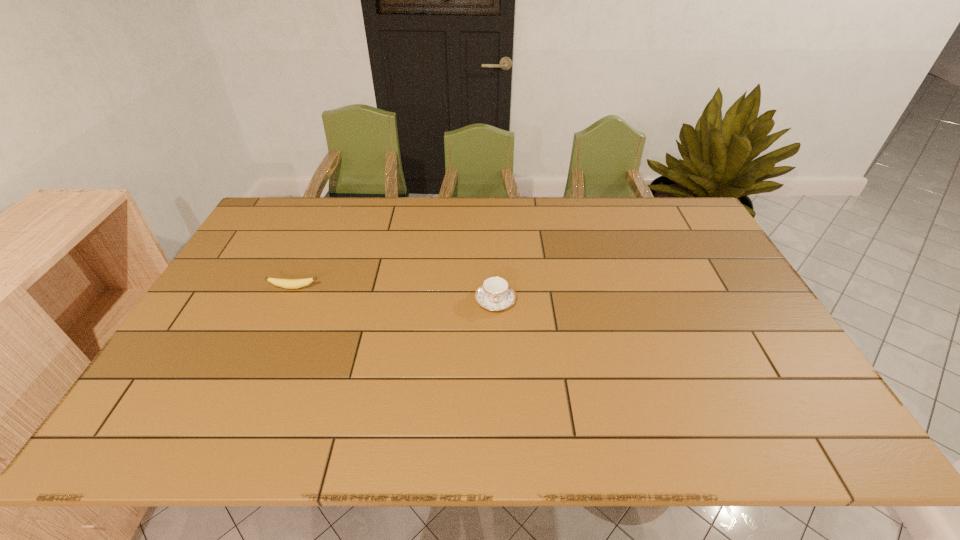
The height and width of the screenshot is (540, 960). Identify the location of vacant region at the far right corner of the desktop. click(x=675, y=206).